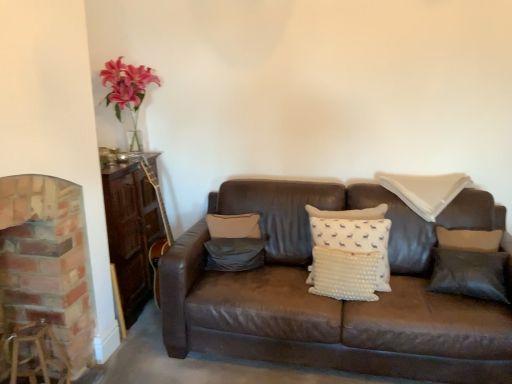
Question: Is black leather pillow at right, arranged as the fourth pillow when viewed from the left, bigger or smaller than white dotted pillow at center, the 3th pillow in the right-to-left sequence?

Choices:
 (A) big
 (B) small

Answer: (B)

Question: Considering their positions, is black leather pillow at right, arranged as the first pillow when viewed from the right, located in front of or behind white dotted pillow at center, the 3th pillow in the right-to-left sequence?

Choices:
 (A) front
 (B) behind

Answer: (B)

Question: Estimate the real-world distances between objects in this image. Which object is closer to the white dotted pillow at center, the 3th pillow in the right-to-left sequence?

Choices:
 (A) dark gray fabric pillow at center, the 1th pillow positioned from the left
 (B) wooden bar stool at lower left
 (C) brick fireplace at left
 (D) white dotted pillow at upper right, acting as the 2th pillow starting from the right
 (E) black leather pillow at right, arranged as the fourth pillow when viewed from the left

Answer: (D)

Question: Which of these objects is positioned farthest from the wooden bar stool at lower left?

Choices:
 (A) dark gray fabric pillow at center, the 1th pillow positioned from the left
 (B) black leather pillow at right, arranged as the fourth pillow when viewed from the left
 (C) white dotted pillow at upper right, the 3th pillow from the left
 (D) brick fireplace at left
 (E) white dotted pillow at center, which is the second pillow in left-to-right order

Answer: (C)